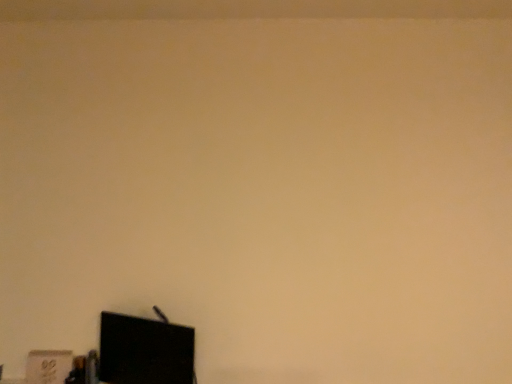
You are a GUI agent. You are given a task and a screenshot of the screen. Output one action in this format:
    pyautogui.click(x=<x>, y=<y>)
    Task: Click on the black glossy monitor at lower left
    This screenshot has height=384, width=512.
    Given the screenshot: What is the action you would take?
    pyautogui.click(x=145, y=351)

The width and height of the screenshot is (512, 384). What do you see at coordinates (145, 351) in the screenshot?
I see `black glossy monitor at lower left` at bounding box center [145, 351].

You are a GUI agent. You are given a task and a screenshot of the screen. Output one action in this format:
    pyautogui.click(x=<x>, y=<y>)
    Task: Click on the black glossy monitor at lower left
    This screenshot has width=512, height=384.
    Given the screenshot: What is the action you would take?
    pyautogui.click(x=145, y=351)